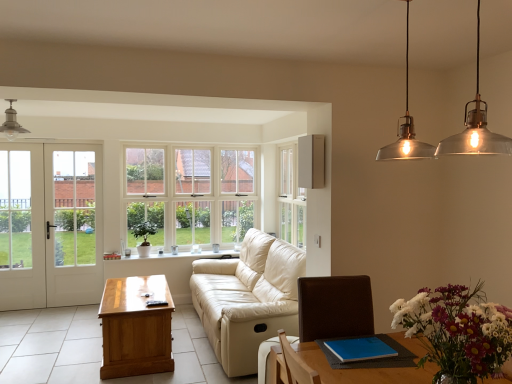
Question: From a real-world perspective, relative to light brown wooden table at left, is multicolored floral bouquet at lower right vertically above or below?

Choices:
 (A) above
 (B) below

Answer: (A)

Question: Is point (497, 367) closer or farther from the camera than point (137, 281)?

Choices:
 (A) closer
 (B) farther

Answer: (A)

Question: Which is farther from the light brown wooden table at left?

Choices:
 (A) multicolored floral bouquet at lower right
 (B) white wooden door at left
 (C) matte silver light fixture at upper left
 (D) beige leather couch at center
 (E) light beige leather armchair at lower center

Answer: (A)

Question: Which object is the closest to the matte silver light fixture at upper left?

Choices:
 (A) white glass door at left
 (B) multicolored floral bouquet at lower right
 (C) light brown wooden table at left
 (D) white wooden door at left
 (E) wooden coffee table at center

Answer: (A)